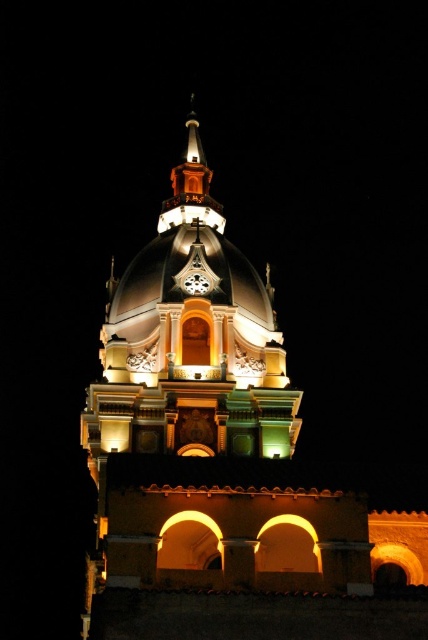
Question: Can you confirm if polished gold dome at center is wider than white glossy clock at center?

Choices:
 (A) yes
 (B) no

Answer: (A)

Question: Which point appears closest to the camera in this image?

Choices:
 (A) (189, 292)
 (B) (202, 170)
 (C) (229, 268)

Answer: (A)

Question: Does polished gold dome at center have a greater width compared to white glossy clock at center?

Choices:
 (A) no
 (B) yes

Answer: (B)

Question: Which point appears closest to the camera in this image?

Choices:
 (A) (211, 289)
 (B) (165, 209)

Answer: (A)

Question: Which of the following is the farthest from the observer?

Choices:
 (A) (190, 209)
 (B) (199, 291)
 (C) (228, 412)

Answer: (A)

Question: Is polished gold dome at center to the right of polished brass spire at upper center from the viewer's perspective?

Choices:
 (A) yes
 (B) no

Answer: (A)